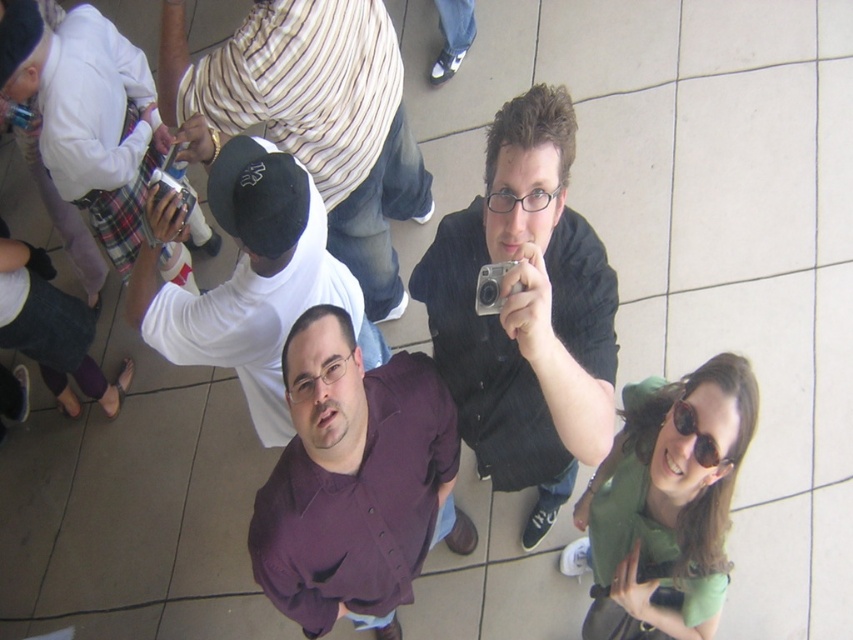
Question: Is matte black shirt at center smaller than white matte cap at upper left?

Choices:
 (A) yes
 (B) no

Answer: (B)

Question: Does matte black shirt at center appear on the left side of white matte shirt at center?

Choices:
 (A) no
 (B) yes

Answer: (A)

Question: Which object is the closest to the silver metallic camera at center?

Choices:
 (A) white matte cap at upper left
 (B) matte black shirt at center
 (C) green fabric shirt at center

Answer: (B)

Question: Is purple button-up shirt at center thinner than white matte cap at upper left?

Choices:
 (A) no
 (B) yes

Answer: (B)

Question: Which of the following is the farthest from the observer?

Choices:
 (A) denim pants at lower left
 (B) white cotton shirt at upper left

Answer: (A)

Question: Which object is farther from the camera taking this photo?

Choices:
 (A) matte black shirt at center
 (B) sunglasses at upper center

Answer: (B)